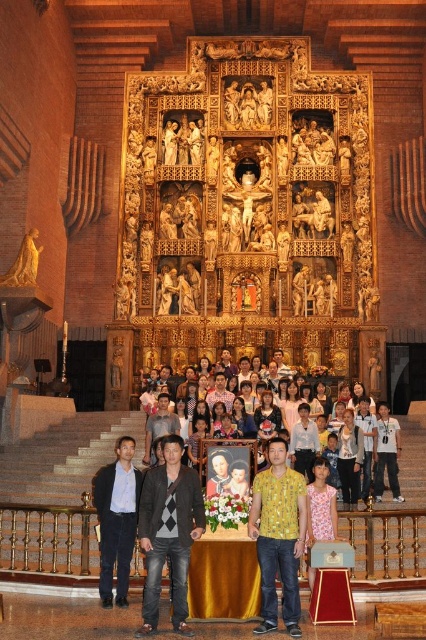
You are standing in the grand church and want to locate the yellow printed shirt at center. According to the coordinates provided, where should you look to find it?

The yellow printed shirt at center is located at coordinates point (279, 536), which means it is positioned towards the upper right side of the scene.

You are a photographer positioned behind the altar. You need to capture a photo of the dark gray sweater at center and the dark blue suit at lower left. Which of the two items has a smaller width?

The dark gray sweater at center has a lesser width compared to the dark blue suit at lower left, so the dark gray sweater at center is smaller in width.

You are standing at the back of the church and want to hand a flower to the person in the dark blue suit at lower left and the person in the light blue shirt at center. Which person should you approach first to reach them without walking past the other?

You should approach the dark blue suit at lower left first because it is closer to you than the light blue shirt at center, so you can reach them without needing to walk past the other person.